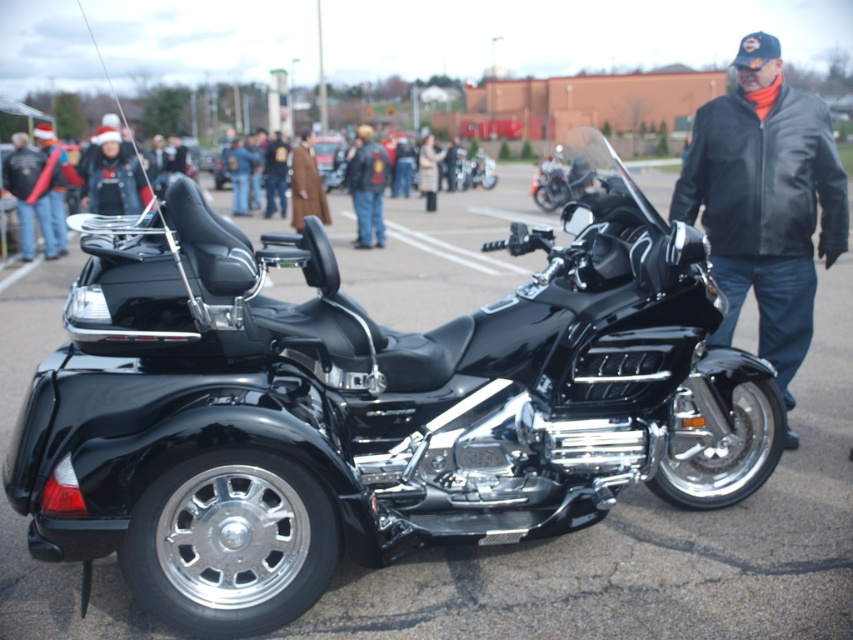
Who is positioned more to the left, black metallic motorcycle at center or light beige coat at center?

light beige coat at center is more to the left.

Between black metallic motorcycle at center and light beige coat at center, which one has less height?

Standing shorter between the two is black metallic motorcycle at center.

Image resolution: width=853 pixels, height=640 pixels. Describe the element at coordinates (474, 170) in the screenshot. I see `black metallic motorcycle at center` at that location.

Where is `black metallic motorcycle at center`? This screenshot has width=853, height=640. black metallic motorcycle at center is located at coordinates (474, 170).

The image size is (853, 640). What are the coordinates of `black polished trike at center` in the screenshot? It's located at (370, 404).

Does black polished trike at center appear over black leather jacket at center?

Yes.

Is point (183, 305) closer to viewer compared to point (697, 136)?

Yes, point (183, 305) is closer to viewer.

Where is `black polished trike at center`? Image resolution: width=853 pixels, height=640 pixels. black polished trike at center is located at coordinates pos(370,404).

Is brown wool coat at center further to the viewer compared to light beige coat at center?

No, it is in front of light beige coat at center.

Is point (310, 189) behind point (444, 154)?

No, it is not.

The image size is (853, 640). Identify the location of brown wool coat at center. (306, 184).